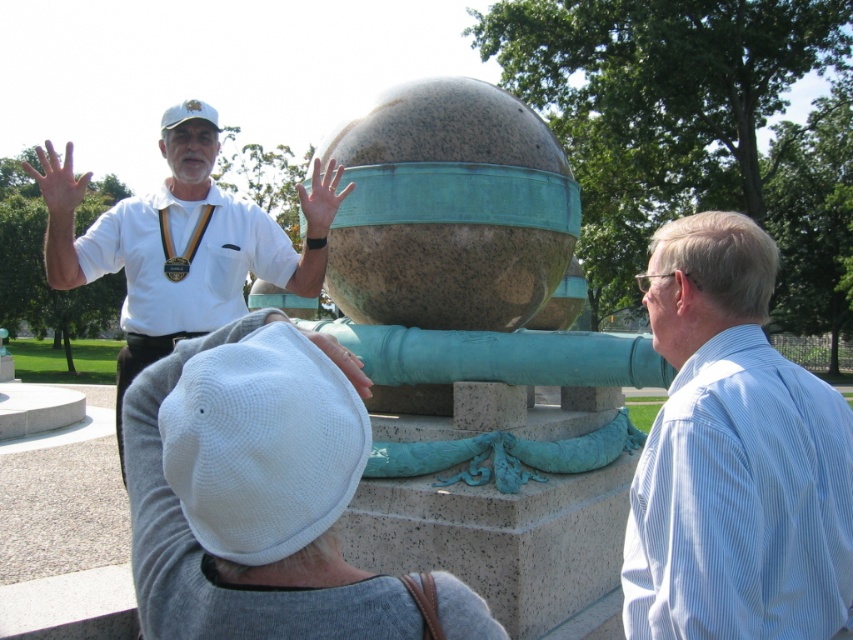
Who is positioned more to the right, granite sphere at center or matte bronze sphere at center?

granite sphere at center

Which is above, granite sphere at center or matte bronze sphere at center?

matte bronze sphere at center is above.

You are a GUI agent. You are given a task and a screenshot of the screen. Output one action in this format:
    pyautogui.click(x=<x>, y=<y>)
    Task: Click on the granite sphere at center
    This screenshot has height=640, width=853.
    Given the screenshot: What is the action you would take?
    pyautogui.click(x=469, y=285)

From the picture: Does blue striped shirt at right appear on the right side of matte bronze sphere at center?

Indeed, blue striped shirt at right is positioned on the right side of matte bronze sphere at center.

Consider the image. Who is positioned more to the right, blue striped shirt at right or matte bronze sphere at center?

blue striped shirt at right

Is point (798, 420) more distant than point (312, 234)?

That is False.

At what (x,y) coordinates should I click in order to perform the action: click on blue striped shirt at right. Please return your answer as a coordinate pair (x, y). The height and width of the screenshot is (640, 853). Looking at the image, I should click on (734, 456).

Is dry skin at center smaller than matte white hand at center?

Actually, dry skin at center might be larger than matte white hand at center.

Consider the image. Does dry skin at center appear over matte white hand at center?

Correct, dry skin at center is located above matte white hand at center.

Between point (44, 172) and point (328, 340), which one is positioned behind?

Point (44, 172)

Locate an element on the screen. This screenshot has height=640, width=853. dry skin at center is located at coordinates (57, 180).